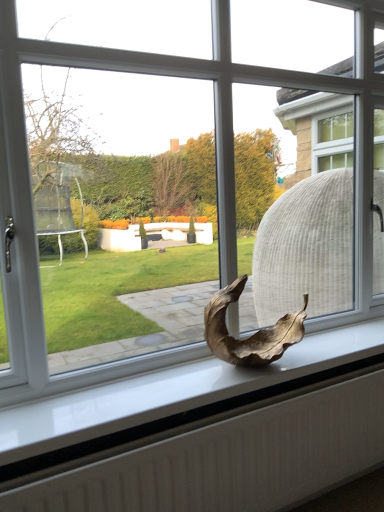
Describe the element at coordinates (232, 459) in the screenshot. I see `white textured radiator at lower center` at that location.

Image resolution: width=384 pixels, height=512 pixels. Identify the location of white textured radiator at lower center. (232, 459).

Measure the distance between point (257, 332) and camera.

A distance of 5.53 feet exists between point (257, 332) and camera.

Describe the element at coordinates (251, 335) in the screenshot. I see `dry leaf at center` at that location.

Where is `dry leaf at center`? dry leaf at center is located at coordinates (251, 335).

You are a GUI agent. You are given a task and a screenshot of the screen. Output one action in this format:
    pyautogui.click(x=<x>, y=<y>)
    Task: Click on the white textured radiator at lower center
    
    Given the screenshot: What is the action you would take?
    pyautogui.click(x=232, y=459)

Considering the relative positions of white textured radiator at lower center and dry leaf at center in the image provided, is white textured radiator at lower center to the right of dry leaf at center from the viewer's perspective?

In fact, white textured radiator at lower center is to the left of dry leaf at center.

Is white textured radiator at lower center positioned before dry leaf at center?

Yes.

Does point (73, 480) come behind point (213, 352)?

No, it is in front of (213, 352).

From the image's perspective, is white textured radiator at lower center over dry leaf at center?

Incorrect, from the image's perspective, white textured radiator at lower center is lower than dry leaf at center.

In the scene shown: From a real-world perspective, is white textured radiator at lower center physically below dry leaf at center?

Yes.

Between white textured radiator at lower center and dry leaf at center, which one has larger width?

dry leaf at center.

Considering the sizes of white textured radiator at lower center and dry leaf at center in the image, is white textured radiator at lower center taller or shorter than dry leaf at center?

Considering their sizes, white textured radiator at lower center has more height than dry leaf at center.

Can you confirm if white textured radiator at lower center is smaller than dry leaf at center?

No.

Would you say dry leaf at center is part of white textured radiator at lower center's contents?

No, dry leaf at center is not inside white textured radiator at lower center.

Does white textured radiator at lower center touch dry leaf at center?

white textured radiator at lower center and dry leaf at center are clearly separated.

Consider the image. Is white textured radiator at lower center turned away from dry leaf at center?

No, white textured radiator at lower center is not facing away from dry leaf at center.

The height and width of the screenshot is (512, 384). Find the location of `animal on the right of white textured radiator at lower center`. animal on the right of white textured radiator at lower center is located at coordinates (251, 335).

Considering the relative positions of dry leaf at center and white textured radiator at lower center in the image provided, is dry leaf at center to the left of white textured radiator at lower center from the viewer's perspective?

No.

Does dry leaf at center come in front of white textured radiator at lower center?

No, dry leaf at center is behind white textured radiator at lower center.

Does point (225, 357) come farther from viewer compared to point (256, 409)?

Yes, it is behind point (256, 409).

From the image's perspective, does dry leaf at center appear lower than white textured radiator at lower center?

Incorrect, from the image's perspective, dry leaf at center is higher than white textured radiator at lower center.

From a real-world perspective, relative to white textured radiator at lower center, is dry leaf at center vertically above or below?

In terms of real-world spatial position, dry leaf at center is above white textured radiator at lower center.

Considering the sizes of dry leaf at center and white textured radiator at lower center in the image, is dry leaf at center wider or thinner than white textured radiator at lower center?

In the image, dry leaf at center appears to be wider than white textured radiator at lower center.

Considering the relative sizes of dry leaf at center and white textured radiator at lower center in the image provided, is dry leaf at center taller than white textured radiator at lower center?

No, dry leaf at center is not taller than white textured radiator at lower center.

Considering the sizes of objects dry leaf at center and white textured radiator at lower center in the image provided, who is bigger, dry leaf at center or white textured radiator at lower center?

With larger size is white textured radiator at lower center.

Is white textured radiator at lower center inside dry leaf at center?

No, white textured radiator at lower center is not surrounded by dry leaf at center.

Can you see dry leaf at center touching white textured radiator at lower center?

No.

Could you tell me if dry leaf at center is turned towards white textured radiator at lower center?

No, dry leaf at center is not facing towards white textured radiator at lower center.

What's the angular difference between dry leaf at center and white textured radiator at lower center's facing directions?

1.14 degrees.

I want to click on radiator located below the dry leaf at center (from the image's perspective), so click(232, 459).

Locate an element on the screen. Image resolution: width=384 pixels, height=512 pixels. radiator in front of the dry leaf at center is located at coordinates (232, 459).

This screenshot has width=384, height=512. What are the coordinates of `animal above the white textured radiator at lower center (from the image's perspective)` in the screenshot? It's located at (251, 335).